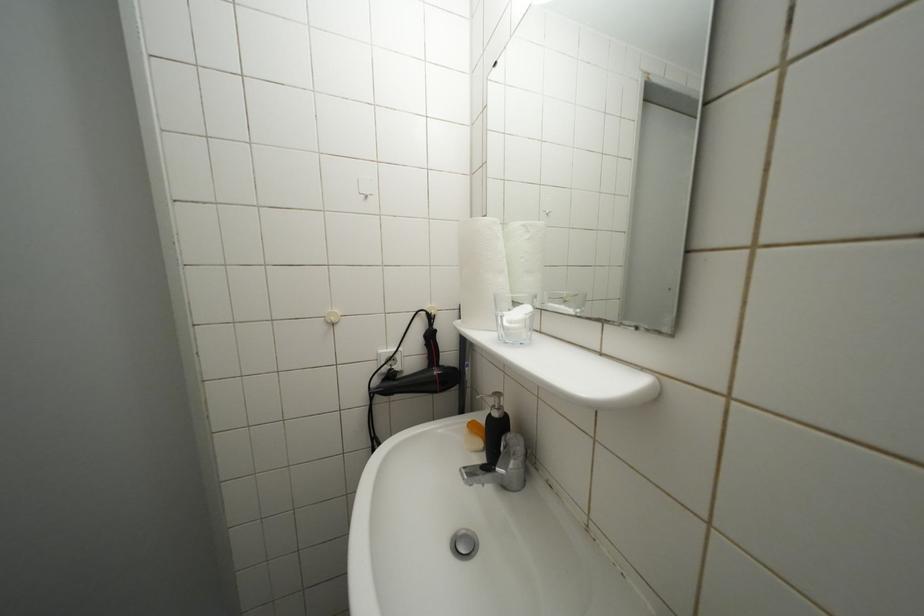
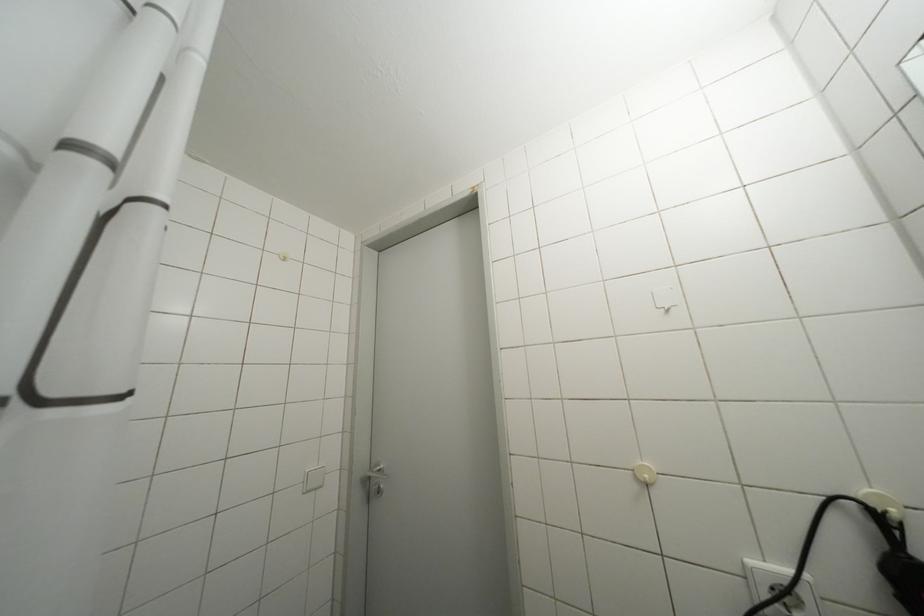
The images are taken continuously from a first-person perspective. In which direction is your viewpoint rotating?

The camera rotated toward left-up.